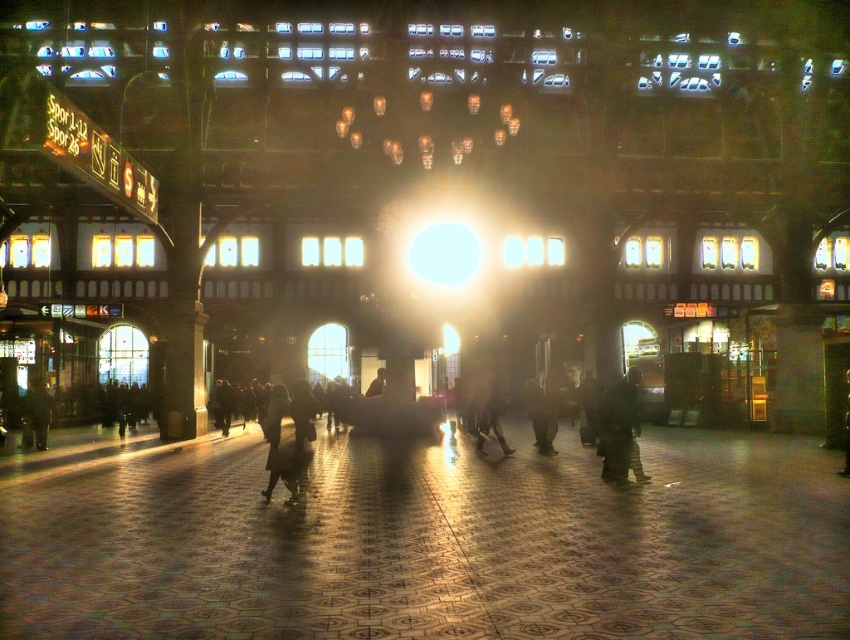
Question: Which point appears farthest from the camera in this image?

Choices:
 (A) (309, 424)
 (B) (843, 476)
 (C) (632, 408)

Answer: (B)

Question: Which of the following is the farthest from the observer?

Choices:
 (A) dark gray fabric coat at center
 (B) dark gray pants at center
 (C) dark green fabric jacket at center

Answer: (A)

Question: Which object is closer to the camera taking this photo?

Choices:
 (A) dark brown leather jacket at lower right
 (B) dark gray pants at center

Answer: (B)

Question: Considering the relative positions of dark green fabric jacket at center and dark textured coat at center in the image provided, where is dark green fabric jacket at center located with respect to dark textured coat at center?

Choices:
 (A) left
 (B) right

Answer: (B)

Question: Does dark green fabric jacket at center have a greater width compared to dark gray fabric coat at center?

Choices:
 (A) no
 (B) yes

Answer: (B)

Question: Does dark green fabric jacket at center have a larger size compared to dark textured coat at center?

Choices:
 (A) yes
 (B) no

Answer: (A)